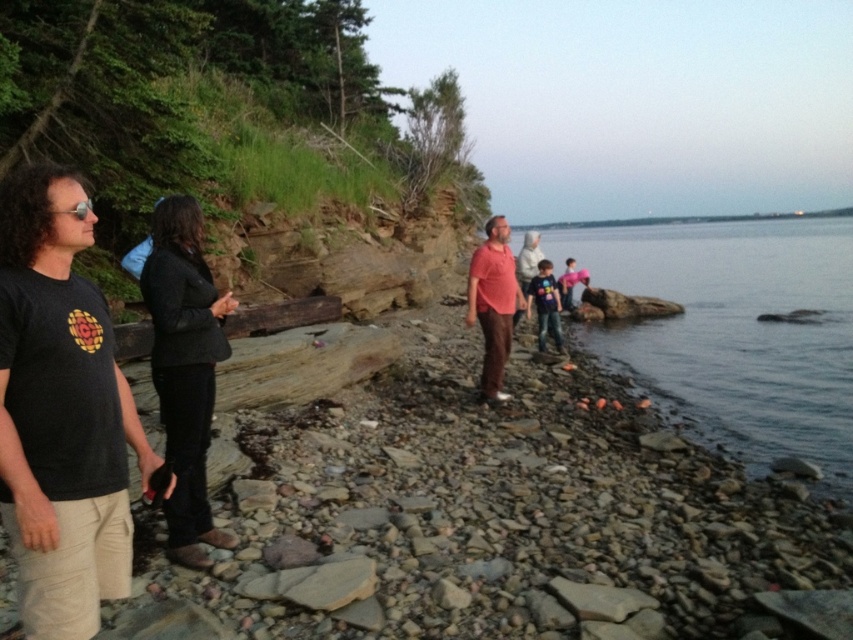
Is point (212, 388) less distant than point (495, 385)?

Yes, point (212, 388) is in front of point (495, 385).

Is black wool jacket at left bigger than matte red shirt at center?

No.

Between point (177, 403) and point (508, 312), which one is positioned in front?

Point (177, 403) is in front.

Where is `black wool jacket at left`? black wool jacket at left is located at coordinates (184, 369).

Is point (9, 227) positioned before point (468, 324)?

Yes, point (9, 227) is in front of point (468, 324).

Is black matte t-shirt at left closer to the viewer compared to matte red shirt at center?

That is True.

Is point (67, 232) in front of point (514, 291)?

Yes.

This screenshot has width=853, height=640. Identify the location of black matte t-shirt at left. (61, 412).

How distant is clear water at lower right from pink fabric at center?

The distance of clear water at lower right from pink fabric at center is 34.25 meters.

Who is taller, clear water at lower right or pink fabric at center?

clear water at lower right is taller.

What do you see at coordinates (735, 330) in the screenshot? I see `clear water at lower right` at bounding box center [735, 330].

Image resolution: width=853 pixels, height=640 pixels. I want to click on clear water at lower right, so click(x=735, y=330).